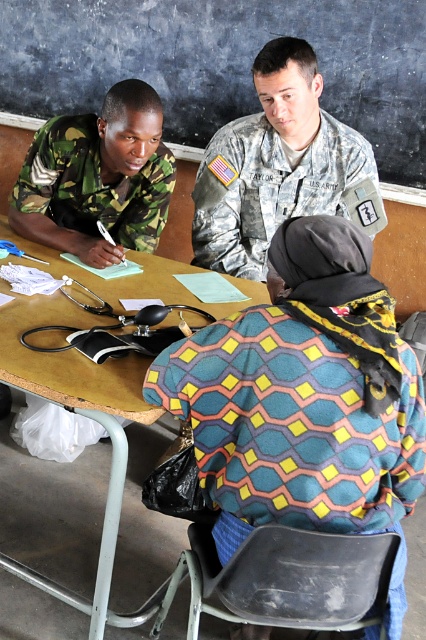
Who is more forward, (x=324, y=413) or (x=31, y=189)?

Point (x=324, y=413)

Is camouflage fabric uniform at upper center wider than camouflage fabric uniform at left?

Yes.

Who is more distant from viewer, (299,298) or (120,257)?

Point (120,257)

Identify the location of camouflage fabric uniform at upper center. (305, 401).

Looking at this image, between camouflage fabric uniform at upper center and wooden table at center, which one has less height?

camouflage fabric uniform at upper center

Where is `camouflage fabric uniform at upper center`? The width and height of the screenshot is (426, 640). camouflage fabric uniform at upper center is located at coordinates (305, 401).

This screenshot has width=426, height=640. What do you see at coordinates (305, 401) in the screenshot? I see `camouflage fabric uniform at upper center` at bounding box center [305, 401].

Locate an element on the screen. camouflage fabric uniform at upper center is located at coordinates [305, 401].

Does wooden table at center have a lesser width compared to camouflage fabric uniform at left?

No.

Does wooden table at center come behind camouflage fabric uniform at left?

No, it is not.

Locate an element on the screen. wooden table at center is located at coordinates (83, 413).